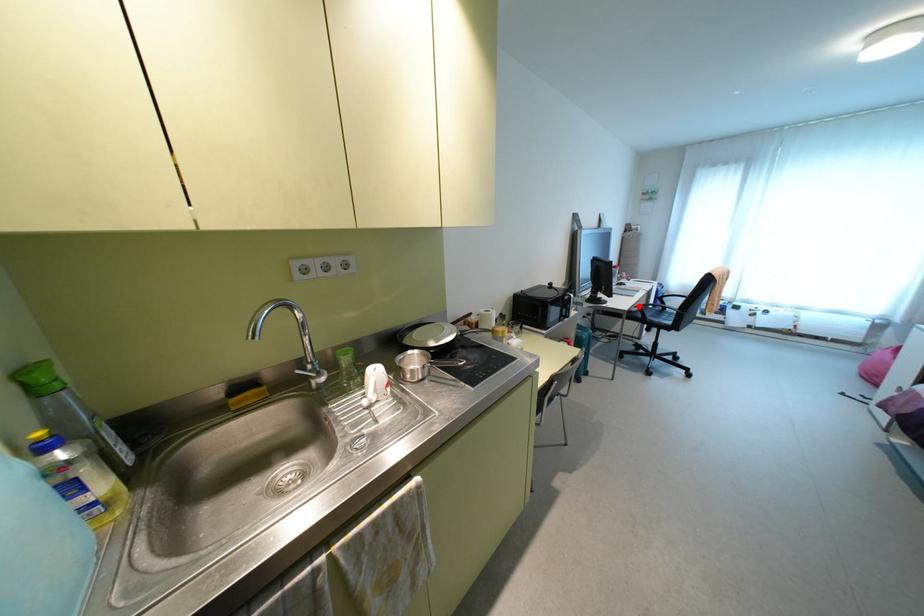
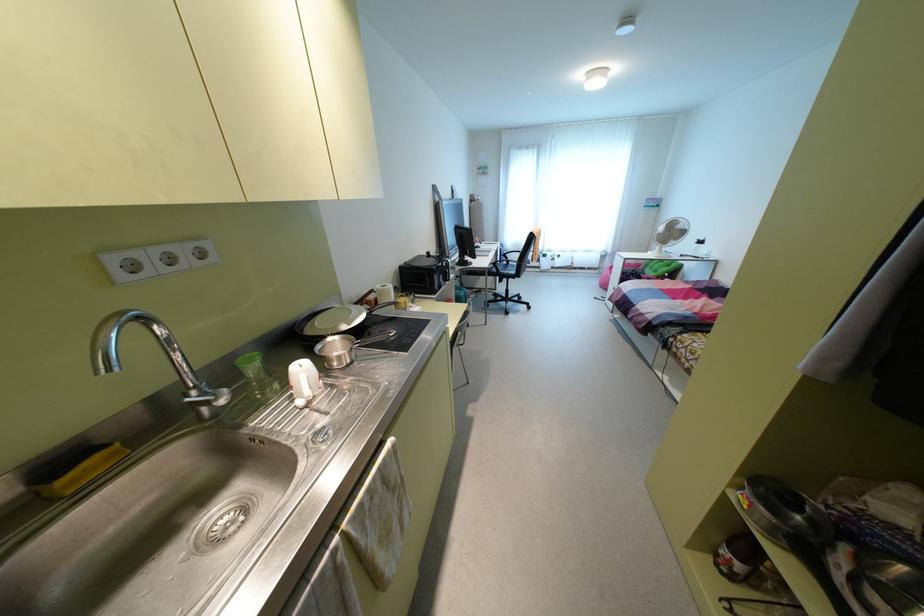
Locate, in the second image, the point that corresponds to the highlighted location in the first image.

(493, 262)